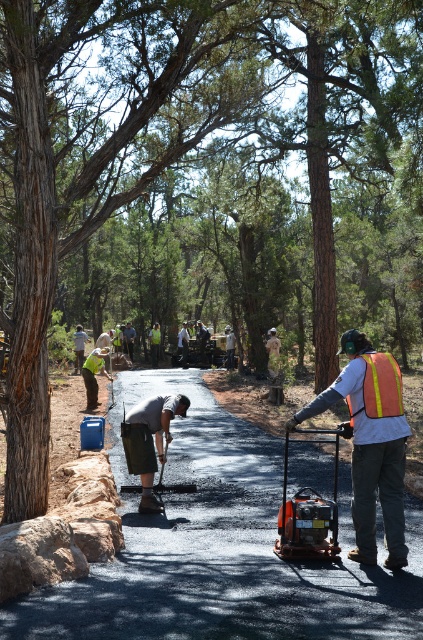
You are a construction supervisor standing at the camera position. You need to check if the worker in the orange reflective vest at right is within the safe distance of 5 meters for equipment operation. Can you confirm this?

The orange reflective vest at right and the camera are 6.04 meters apart. Since the required safe distance is 5 meters, the worker in the orange reflective vest at right is beyond the safe distance and needs to move closer.

You are a construction supervisor standing at point A, which is at coordinates point [129,448]. You need to walk to point B, located at point [376,360]. Which direction should you move to reach point B from point A?

To reach point B from point A, you should move forward since point A is behind point B according to their coordinates.